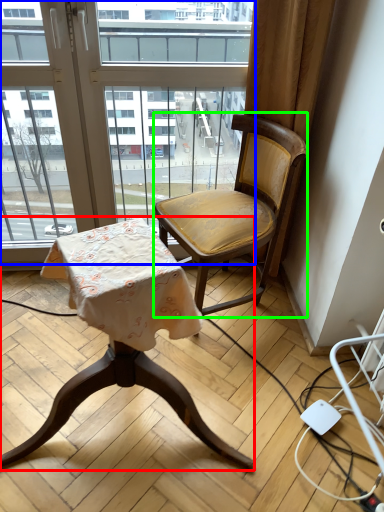
Question: Based on their relative distances, which object is farther from chair (highlighted by a red box)? Choose from window (highlighted by a blue box) and chair (highlighted by a green box).

Choices:
 (A) window
 (B) chair

Answer: (A)